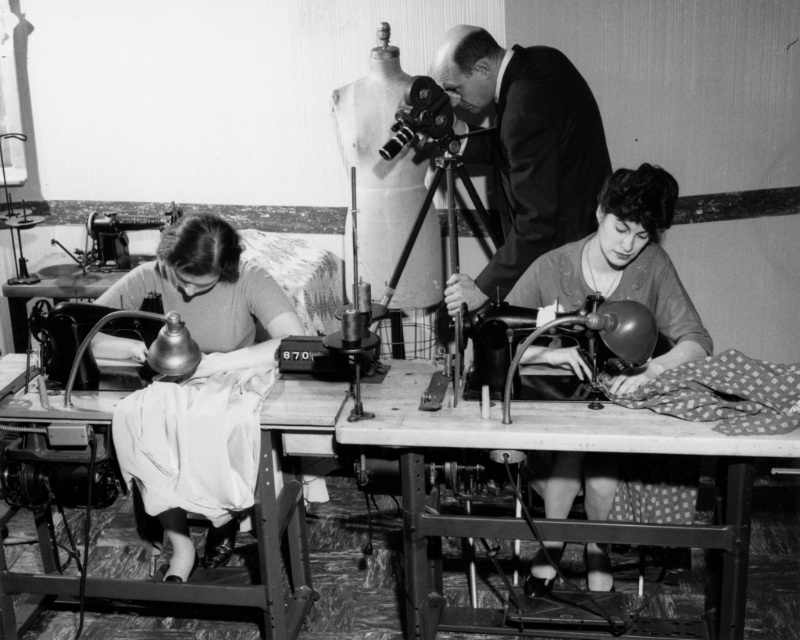
Question: From the image, what is the correct spatial relationship of smooth black suit at upper center in relation to metallic sewing machine at lower center?

Choices:
 (A) right
 (B) left

Answer: (A)

Question: Which of the following is the farthest from the observer?

Choices:
 (A) wooden table at center
 (B) metallic sewing machine at left
 (C) metallic sewing machine at lower center

Answer: (B)

Question: Can you confirm if dotted fabric dress at lower center is thinner than smooth black suit at upper center?

Choices:
 (A) yes
 (B) no

Answer: (A)

Question: Estimate the real-world distances between objects in this image. Which object is farther from the wooden table at center?

Choices:
 (A) dotted fabric dress at lower center
 (B) matte white fabric at left
 (C) smooth black suit at upper center

Answer: (C)

Question: Based on their relative distances, which object is farther from the metallic sewing machine at lower center?

Choices:
 (A) dotted fabric dress at lower center
 (B) metallic sewing machine at left
 (C) wooden table at center

Answer: (B)

Question: Is dotted fabric dress at lower center bigger than metallic sewing machine at left?

Choices:
 (A) yes
 (B) no

Answer: (A)